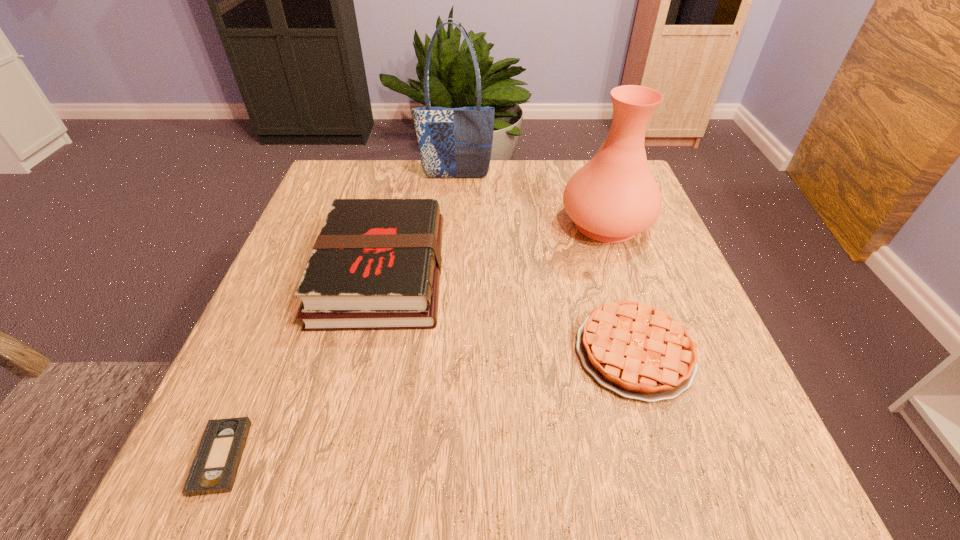
Locate an element on the screen. the tallest object is located at coordinates (454, 142).

In order to click on shopping bag in this screenshot , I will do `click(454, 142)`.

In order to click on the fourth shortest object in this screenshot , I will do `click(614, 196)`.

I want to click on the third shortest object, so click(376, 264).

At what (x,y) coordinates should I click in order to perform the action: click on pie. Please return your answer as a coordinate pair (x, y). This screenshot has height=540, width=960. Looking at the image, I should click on (640, 352).

This screenshot has height=540, width=960. Find the location of `the shortest object`. the shortest object is located at coordinates (215, 466).

Where is `the leftmost object`? The width and height of the screenshot is (960, 540). the leftmost object is located at coordinates (215, 466).

Identify the location of vacant region located 0.070m on the front-facing side of the shopping bag. The image size is (960, 540). (455, 197).

Find the location of a particular element. The height and width of the screenshot is (540, 960). vacant area located 0.180m on the back of the vase is located at coordinates (585, 161).

Locate an element on the screen. This screenshot has width=960, height=540. vacant space located on the right of the hardback book is located at coordinates (540, 272).